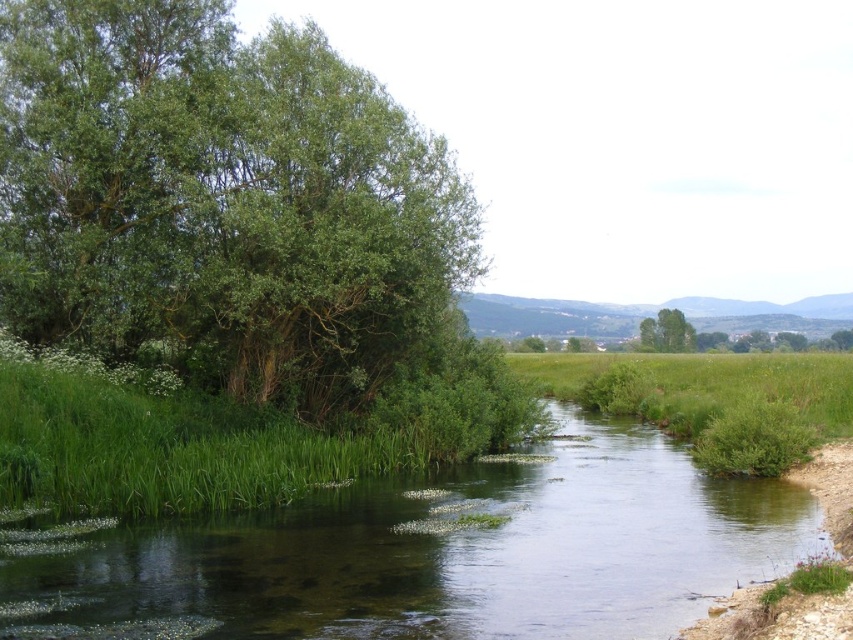
Question: Which point is closer to the camera taking this photo?

Choices:
 (A) (659, 312)
 (B) (271, 340)
 (C) (788, 550)

Answer: (C)

Question: Which point is closer to the camera taking this photo?

Choices:
 (A) (393, 141)
 (B) (674, 333)

Answer: (A)

Question: Is green leafy tree at left below green grassy river at center?

Choices:
 (A) no
 (B) yes

Answer: (A)

Question: Which point appears closest to the camera in this image?

Choices:
 (A) (351, 109)
 (B) (732, 538)

Answer: (B)

Question: Is green leafy tree at left smaller than green grassy river at center?

Choices:
 (A) no
 (B) yes

Answer: (A)

Question: Can you confirm if green leafy tree at left is positioned to the right of green grassy river at center?

Choices:
 (A) no
 (B) yes

Answer: (A)